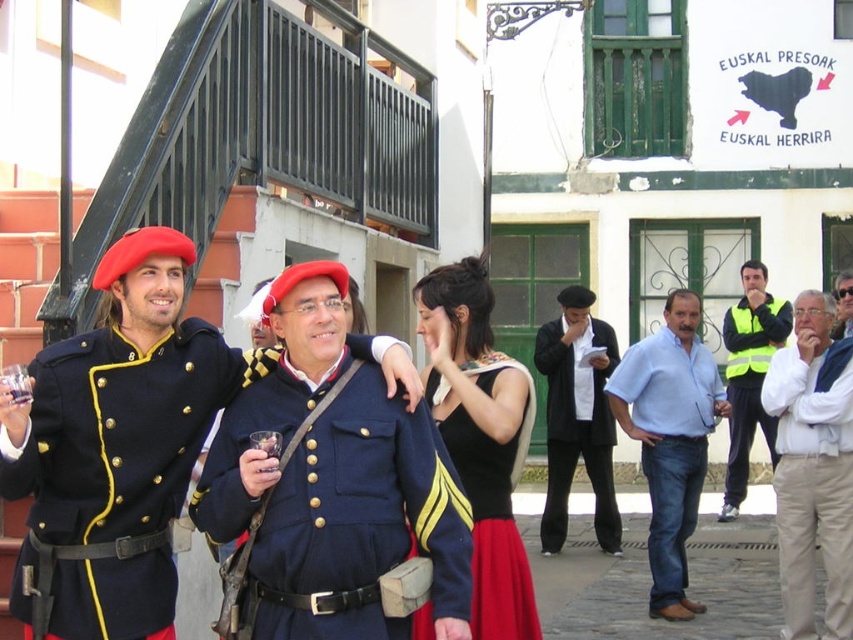
Is blue cotton uniform at center below yellow reflective vest at right?

No.

Does point (462, 618) come farther from viewer compared to point (724, 344)?

No, it is not.

What do you see at coordinates (360, 520) in the screenshot?
I see `blue cotton uniform at center` at bounding box center [360, 520].

Find the location of `blue cotton uniform at center`. blue cotton uniform at center is located at coordinates (360, 520).

Can you confirm if black satin dress at center is positioned below yellow reflective vest at right?

Yes.

Does black satin dress at center appear on the left side of yellow reflective vest at right?

Indeed, black satin dress at center is positioned on the left side of yellow reflective vest at right.

Is point (438, 340) in front of point (781, 317)?

Yes, it is in front of point (781, 317).

The height and width of the screenshot is (640, 853). I want to click on black satin dress at center, so click(x=480, y=436).

Is light blue cotton shirt at center above matte black uniform at center?

Actually, light blue cotton shirt at center is below matte black uniform at center.

Can you confirm if light blue cotton shirt at center is wider than matte black uniform at center?

No.

Is point (706, 444) positioned in front of point (849, 305)?

Yes, it is in front of point (849, 305).

Where is `light blue cotton shirt at center`? light blue cotton shirt at center is located at coordinates (670, 438).